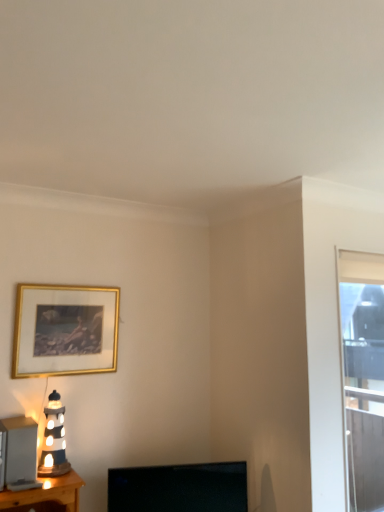
This screenshot has width=384, height=512. What do you see at coordinates (65, 330) in the screenshot? I see `gold metallic picture frame at upper left` at bounding box center [65, 330].

Describe the element at coordinates (54, 439) in the screenshot. I see `matte ceramic lighthouse at left` at that location.

Measure the distance between point (0, 461) and camera.

Point (0, 461) is 6.48 feet away from camera.

Find the location of a particular element. gold metallic picture frame at upper left is located at coordinates (65, 330).

Is point (28, 315) more distant than point (360, 469)?

No, (28, 315) is in front of (360, 469).

From the image's perspective, is gold metallic picture frame at upper left over transparent glass window at right?

Yes, from the image's perspective, gold metallic picture frame at upper left is above transparent glass window at right.

Does transparent glass window at right have a lesser width compared to matte ceramic lighthouse at left?

Yes, transparent glass window at right is thinner than matte ceramic lighthouse at left.

Does transparent glass window at right appear on the right side of matte ceramic lighthouse at left?

Yes, transparent glass window at right is to the right of matte ceramic lighthouse at left.

From a real-world perspective, which is physically below, transparent glass window at right or matte ceramic lighthouse at left?

From a 3D spatial view, matte ceramic lighthouse at left is below.

Who is taller, transparent glass window at right or matte ceramic lighthouse at left?

transparent glass window at right is taller.

Considering the positions of objects matte ceramic lighthouse at left and transparent glass window at right in the image provided, who is more to the right, matte ceramic lighthouse at left or transparent glass window at right?

From the viewer's perspective, transparent glass window at right appears more on the right side.

From a real-world perspective, which object stands above the other?

In real-world perspective, transparent glass window at right is above.

Does matte ceramic lighthouse at left turn towards transparent glass window at right?

No, matte ceramic lighthouse at left does not turn towards transparent glass window at right.

Is matte ceramic lighthouse at left next to transparent glass window at right?

matte ceramic lighthouse at left and transparent glass window at right are clearly separated.

Is point (55, 390) in front of point (100, 352)?

That is True.

Considering the sizes of objects matte ceramic lighthouse at left and gold metallic picture frame at upper left in the image provided, who is shorter, matte ceramic lighthouse at left or gold metallic picture frame at upper left?

matte ceramic lighthouse at left is shorter.

Could gold metallic picture frame at upper left be considered to be inside matte ceramic lighthouse at left?

No.

Based on the photo, from a real-world perspective, is matte ceramic lighthouse at left beneath gold metallic picture frame at upper left?

Indeed, from a real-world perspective, matte ceramic lighthouse at left is positioned beneath gold metallic picture frame at upper left.

Locate an element on the screen. This screenshot has width=384, height=512. television on the right of gold metallic picture frame at upper left is located at coordinates (179, 488).

From the image's perspective, is gold metallic picture frame at upper left under black glossy tv at lower center?

Incorrect, from the image's perspective, gold metallic picture frame at upper left is higher than black glossy tv at lower center.

Who is more distant, gold metallic picture frame at upper left or black glossy tv at lower center?

gold metallic picture frame at upper left is further away from the camera.

Is gold metallic picture frame at upper left next to black glossy tv at lower center and touching it?

No, gold metallic picture frame at upper left is not next to black glossy tv at lower center.

Does gold metallic picture frame at upper left turn towards matte black lamp at left?

No, gold metallic picture frame at upper left is not aimed at matte black lamp at left.

From a real-world perspective, is gold metallic picture frame at upper left beneath matte black lamp at left?

No, from a real-world perspective, gold metallic picture frame at upper left is not beneath matte black lamp at left.

At what (x,y) coordinates should I click in order to perform the action: click on appliance that appears on the left of gold metallic picture frame at upper left. Please return your answer as a coordinate pair (x, y). Image resolution: width=384 pixels, height=512 pixels. Looking at the image, I should click on (18, 454).

Which object is further away from the camera, gold metallic picture frame at upper left or matte black lamp at left?

gold metallic picture frame at upper left is behind.

Considering the relative sizes of black glossy tv at lower center and transparent glass window at right in the image provided, is black glossy tv at lower center thinner than transparent glass window at right?

Yes.

Is black glossy tv at lower center directly adjacent to transparent glass window at right?

black glossy tv at lower center and transparent glass window at right are not in contact.

Considering the positions of point (231, 477) and point (376, 298), is point (231, 477) closer or farther from the camera than point (376, 298)?

Point (231, 477) is positioned closer to the camera compared to point (376, 298).

Locate an element on the screen. The width and height of the screenshot is (384, 512). picture frame that appears above the transparent glass window at right (from the image's perspective) is located at coordinates (65, 330).

Identify the location of window that appears behind the matte ceramic lighthouse at left. The height and width of the screenshot is (512, 384). (362, 376).

When comparing their distances from matte ceramic lighthouse at left, does transparent glass window at right or matte black lamp at left seem further?

transparent glass window at right.

From the image, which object appears to be nearer to black glossy tv at lower center, matte black lamp at left or transparent glass window at right?

Among the two, matte black lamp at left is located nearer to black glossy tv at lower center.

From the image, which object appears to be nearer to matte ceramic lighthouse at left, gold metallic picture frame at upper left or matte black lamp at left?

Based on the image, matte black lamp at left appears to be nearer to matte ceramic lighthouse at left.

Based on their spatial positions, is black glossy tv at lower center or gold metallic picture frame at upper left closer to matte ceramic lighthouse at left?

gold metallic picture frame at upper left lies closer to matte ceramic lighthouse at left than the other object.

Looking at the image, which one is located closer to matte black lamp at left, transparent glass window at right or matte ceramic lighthouse at left?

matte ceramic lighthouse at left.

Considering their positions, is matte ceramic lighthouse at left positioned further to gold metallic picture frame at upper left than black glossy tv at lower center?

The object further to gold metallic picture frame at upper left is black glossy tv at lower center.

Based on the photo, based on their spatial positions, is gold metallic picture frame at upper left or black glossy tv at lower center closer to matte ceramic lighthouse at left?

Among the two, gold metallic picture frame at upper left is located nearer to matte ceramic lighthouse at left.

Based on their spatial positions, is gold metallic picture frame at upper left or matte black lamp at left closer to black glossy tv at lower center?

Among the two, matte black lamp at left is located nearer to black glossy tv at lower center.

Where is `television between matte black lamp at left and transparent glass window at right from left to right`? The width and height of the screenshot is (384, 512). television between matte black lamp at left and transparent glass window at right from left to right is located at coordinates (179, 488).

The height and width of the screenshot is (512, 384). I want to click on picture frame between matte black lamp at left and transparent glass window at right in the horizontal direction, so click(65, 330).

In order to click on table lamp between gold metallic picture frame at upper left and black glossy tv at lower center in the up-down direction in this screenshot , I will do `click(54, 439)`.

Where is `table lamp between gold metallic picture frame at upper left and matte black lamp at left from top to bottom`? table lamp between gold metallic picture frame at upper left and matte black lamp at left from top to bottom is located at coordinates (54, 439).